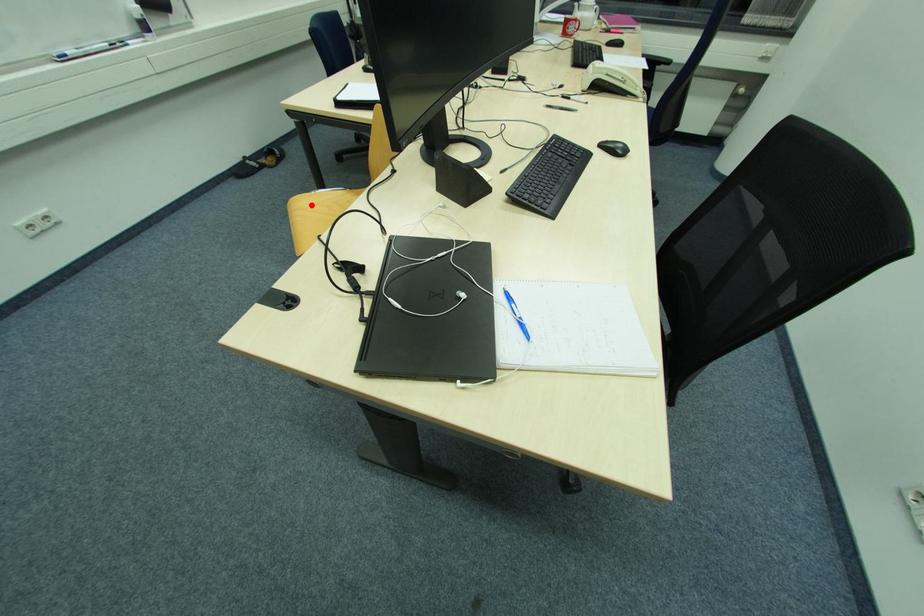
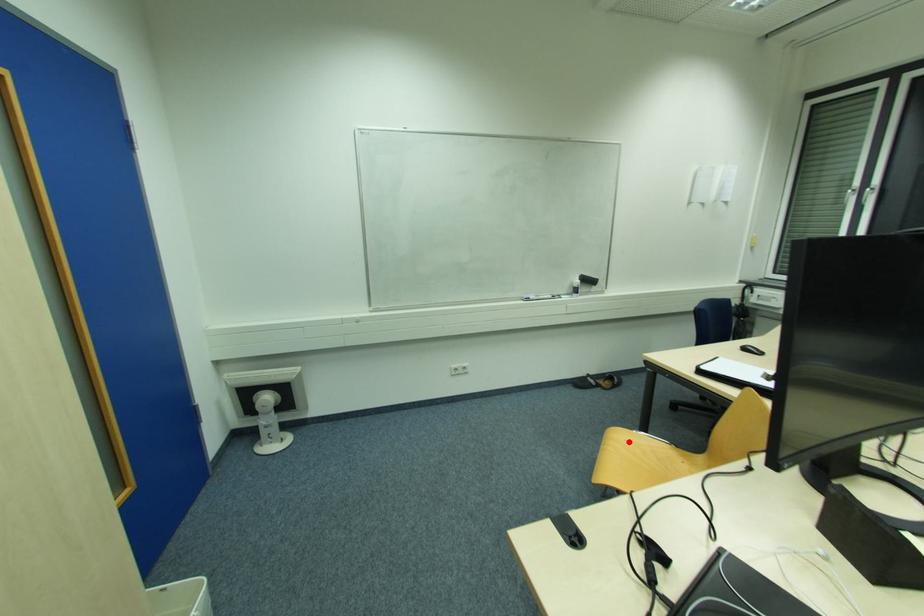
I am providing you with two images of the same scene from different viewpoints. A red point is marked on the first image and another point is marked on the second image. Do the highlighted points in image1 and image2 indicate the same real-world spot?

Yes